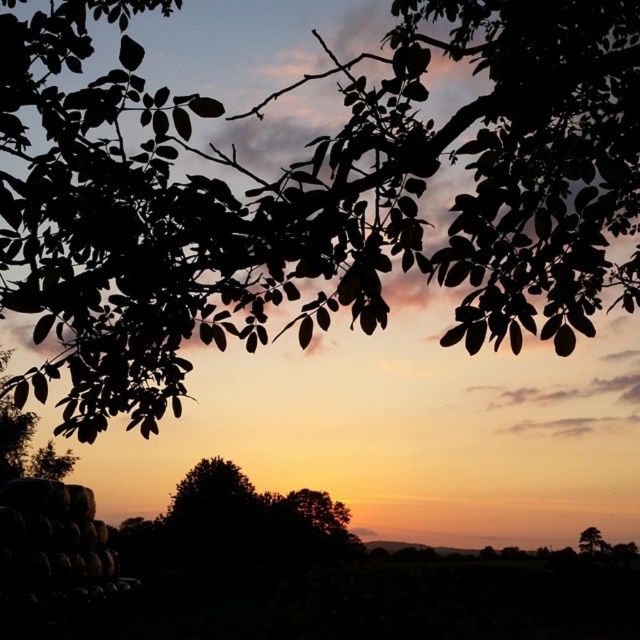
Question: Which object appears farthest from the camera in this image?

Choices:
 (A) green matte tree at upper right
 (B) black leafy branch at upper center

Answer: (A)

Question: Is black leafy branch at upper center positioned at the back of green matte tree at upper right?

Choices:
 (A) yes
 (B) no

Answer: (B)

Question: Among these points, which one is farthest from the camera?

Choices:
 (A) (582, 541)
 (B) (502, 84)

Answer: (A)

Question: Which of the following is the farthest from the observer?

Choices:
 (A) black leafy branch at upper center
 (B) green matte tree at upper right

Answer: (B)

Question: In this image, where is black leafy branch at upper center located relative to green matte tree at upper right?

Choices:
 (A) left
 (B) right

Answer: (A)

Question: Does black leafy branch at upper center come in front of green matte tree at upper right?

Choices:
 (A) no
 (B) yes

Answer: (B)